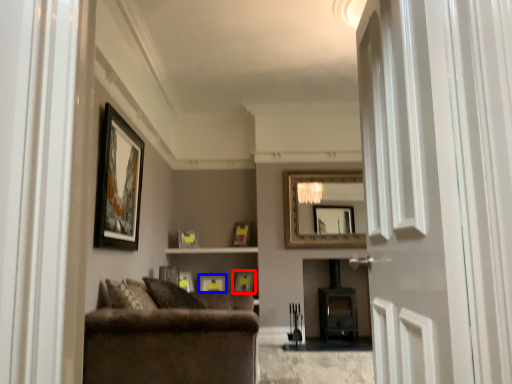
Question: Which point is closer to the camera, picture frame (highlighted by a red box) or picture frame (highlighted by a blue box)?

Choices:
 (A) picture frame
 (B) picture frame

Answer: (A)